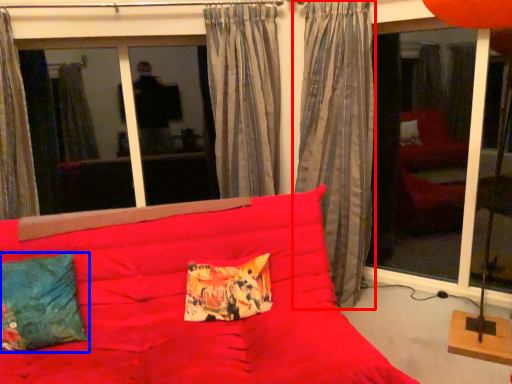
Question: Which object is further to the camera taking this photo, curtain (highlighted by a red box) or pillow (highlighted by a blue box)?

Choices:
 (A) curtain
 (B) pillow

Answer: (A)